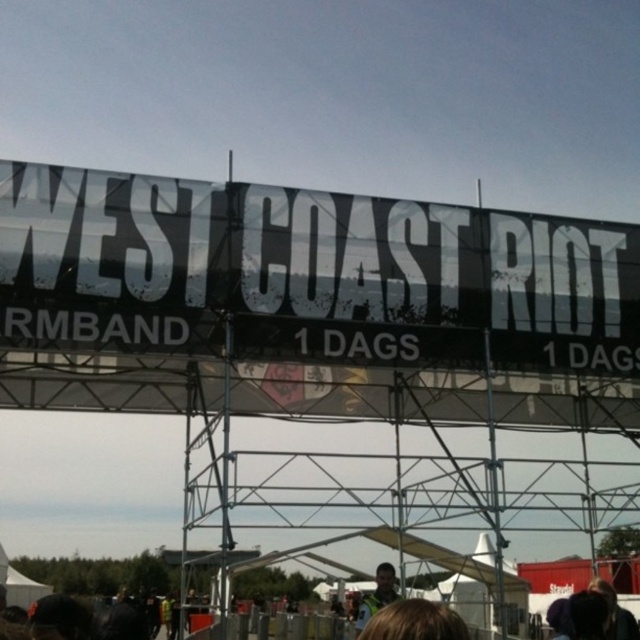
Question: Which of the following is the closest to the observer?

Choices:
 (A) green fabric jacket at center
 (B) blonde hair at lower center

Answer: (B)

Question: Is blonde hair at lower center thinner than green fabric jacket at center?

Choices:
 (A) no
 (B) yes

Answer: (A)

Question: Which object is closer to the camera taking this photo?

Choices:
 (A) green fabric jacket at center
 (B) blonde hair at lower center

Answer: (B)

Question: Can you confirm if blonde hair at lower center is positioned below green fabric jacket at center?

Choices:
 (A) no
 (B) yes

Answer: (A)

Question: From the image, what is the correct spatial relationship of blonde hair at lower center in relation to green fabric jacket at center?

Choices:
 (A) right
 (B) left

Answer: (B)

Question: Which point is closer to the camera taking this photo?

Choices:
 (A) (410, 600)
 (B) (390, 580)

Answer: (A)